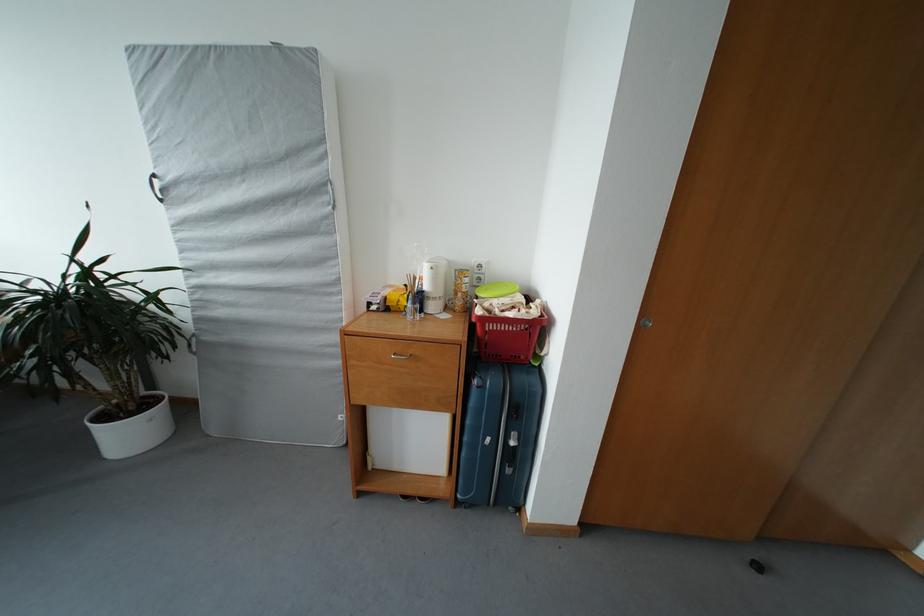
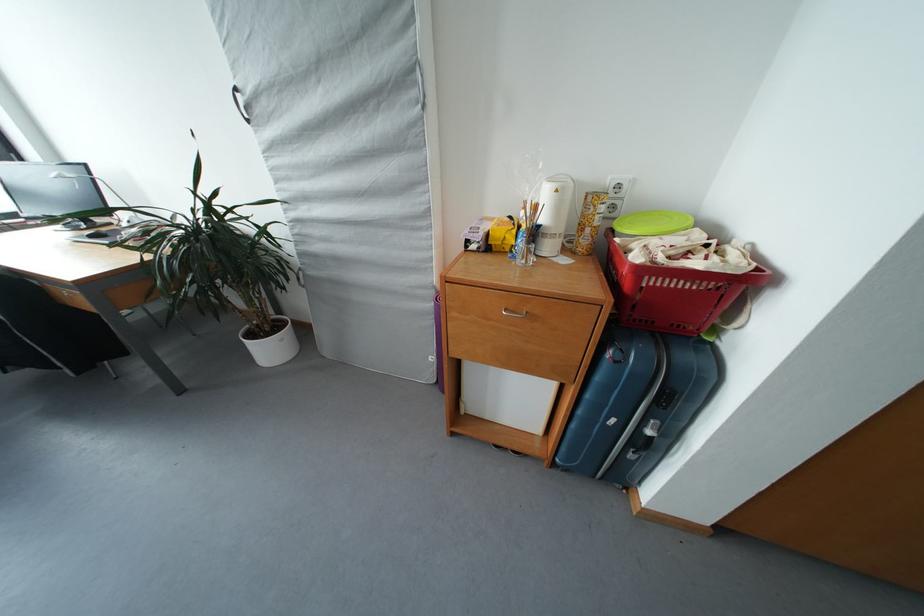
The point at (412,320) is marked in the first image. Where is the corresponding point in the second image?

(520, 262)